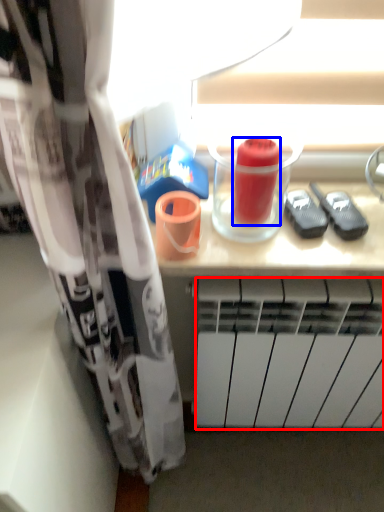
Question: Which of the following is the farthest to the observer, radiator (highlighted by a red box) or beverage (highlighted by a blue box)?

Choices:
 (A) radiator
 (B) beverage

Answer: (A)